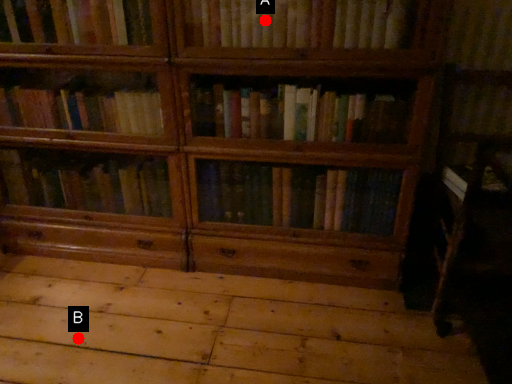
Question: Two points are circled on the image, labeled by A and B beside each circle. Which of the following is the farthest from the observer?

Choices:
 (A) A is further
 (B) B is further

Answer: (B)